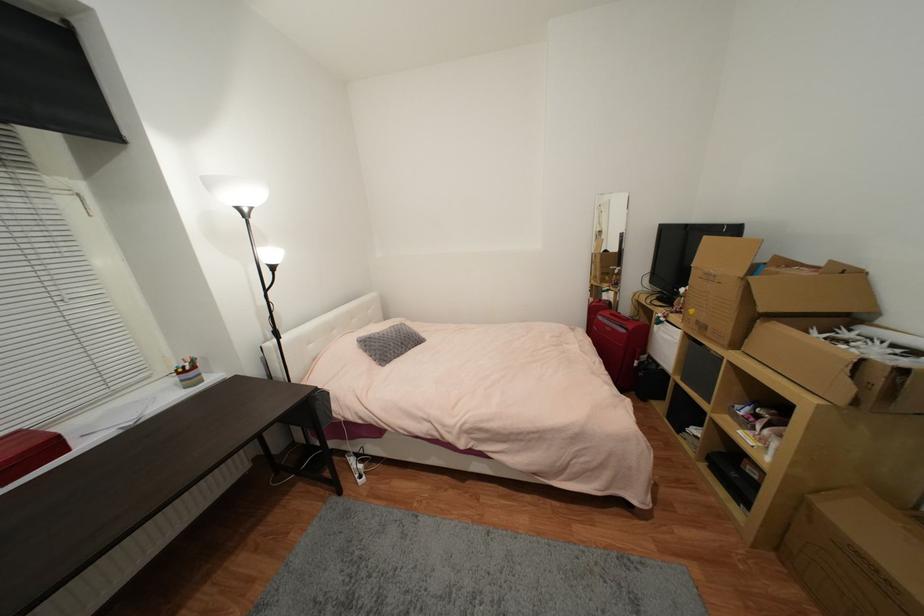
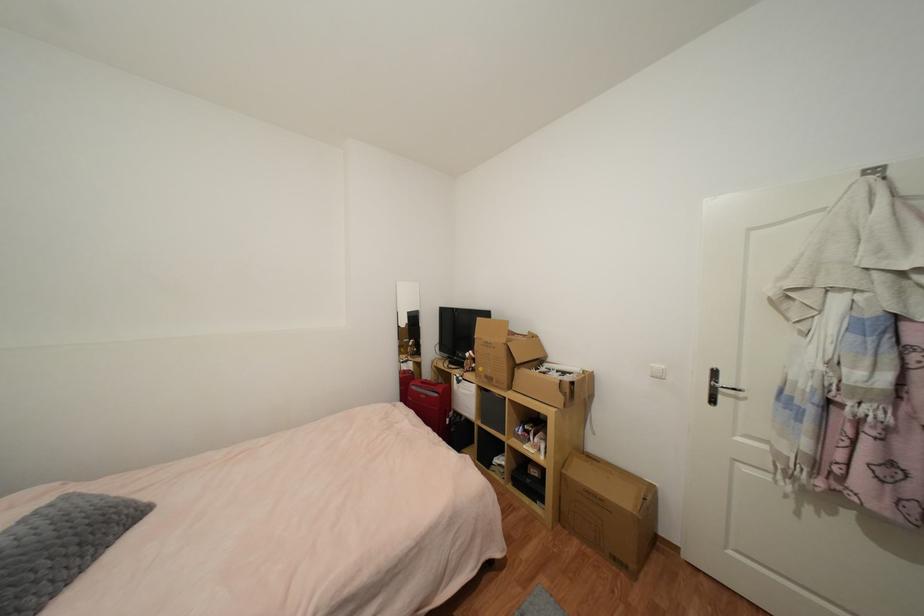
Question: The camera is either moving clockwise (left) or counter-clockwise (right) around the object. The first image is from the beginning of the video and the second image is from the end. Is the camera moving left or right when shooting the video?

Choices:
 (A) Left
 (B) Right

Answer: (A)